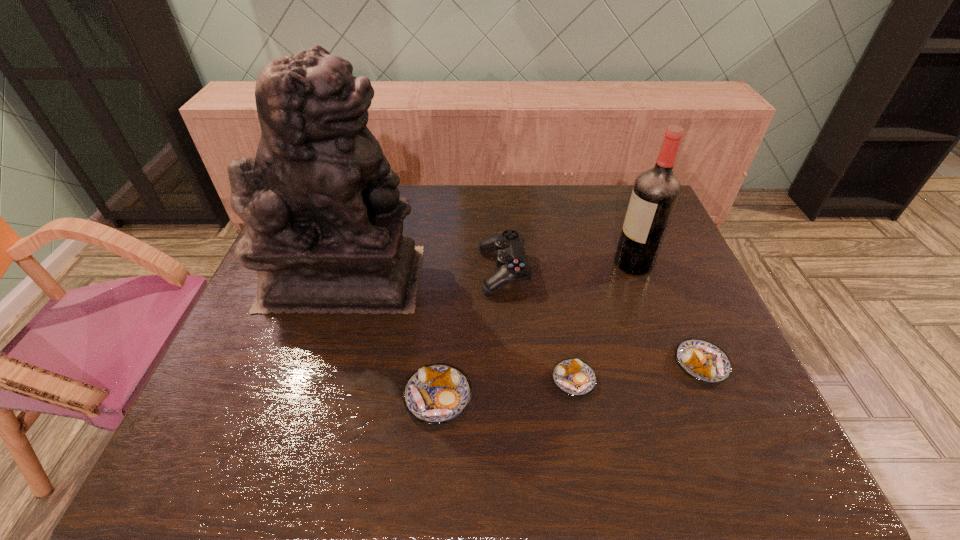
Find the location of `pastry that is the second nearest to the second tallest object`. pastry that is the second nearest to the second tallest object is located at coordinates (574, 377).

The height and width of the screenshot is (540, 960). I want to click on blank space that satisfies the following two spatial constraints: 1. on the front side of the control; 2. on the left side of the second pastry from left to right, so click(509, 380).

The width and height of the screenshot is (960, 540). Identify the location of vacant region that satisfies the following two spatial constraints: 1. on the front-facing side of the tallest object; 2. on the right side of the second shortest object. (316, 364).

The image size is (960, 540). Identify the location of free space that satisfies the following two spatial constraints: 1. on the front-facing side of the tallest object; 2. on the left side of the shortest object. (310, 380).

Find the location of a particular element. vacant space that satisfies the following two spatial constraints: 1. on the front-facing side of the leftmost object; 2. on the back side of the leftmost pastry is located at coordinates (305, 397).